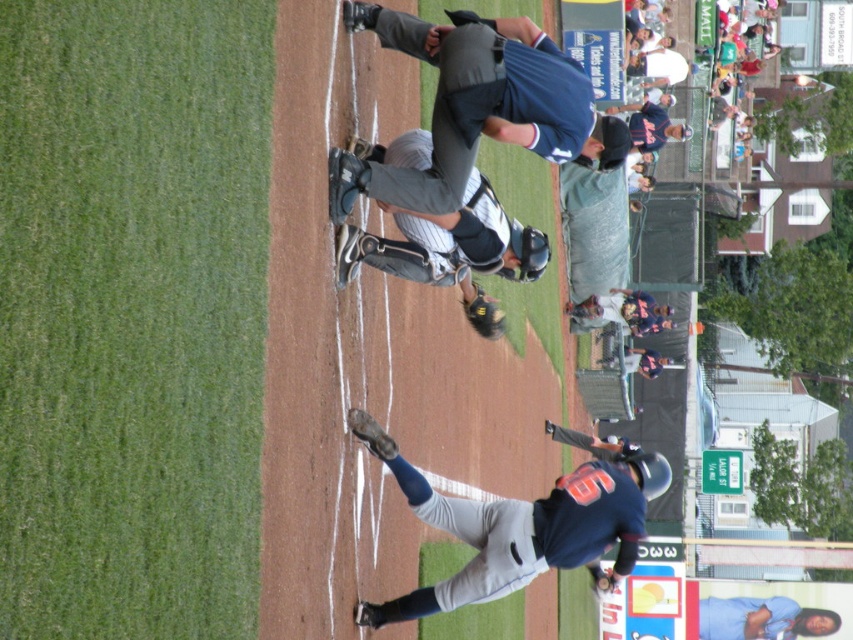
Is dark brown leather glove at center to the right of dark brown leather glove at lower center from the viewer's perspective?

Correct, you'll find dark brown leather glove at center to the right of dark brown leather glove at lower center.

Does dark brown leather glove at center appear under dark brown leather glove at lower center?

Actually, dark brown leather glove at center is above dark brown leather glove at lower center.

Which is behind, point (476, 312) or point (383, 456)?

The point (476, 312) is behind.

Image resolution: width=853 pixels, height=640 pixels. What are the coordinates of `dark brown leather glove at center` in the screenshot? It's located at (482, 310).

Looking at this image, can you confirm if dark blue jersey at center is wider than blue fabric shirt at lower right?

Correct, the width of dark blue jersey at center exceeds that of blue fabric shirt at lower right.

Can you confirm if dark blue jersey at center is positioned above blue fabric shirt at lower right?

Indeed, dark blue jersey at center is positioned over blue fabric shirt at lower right.

You are a GUI agent. You are given a task and a screenshot of the screen. Output one action in this format:
    pyautogui.click(x=<x>, y=<y>)
    Task: Click on the dark blue jersey at center
    This screenshot has width=853, height=640.
    Given the screenshot: What is the action you would take?
    pyautogui.click(x=527, y=532)

Where is `dark blue jersey at center`? The height and width of the screenshot is (640, 853). dark blue jersey at center is located at coordinates (527, 532).

Does point (659, 465) come behind point (425, 243)?

Yes, point (659, 465) is behind point (425, 243).

Which is above, dark blue jersey at center or gray fabric catcher at center?

Positioned higher is gray fabric catcher at center.

Is point (602, 586) behind point (416, 129)?

Yes, point (602, 586) is farther from viewer.

Where is `dark blue jersey at center`? Image resolution: width=853 pixels, height=640 pixels. dark blue jersey at center is located at coordinates (527, 532).